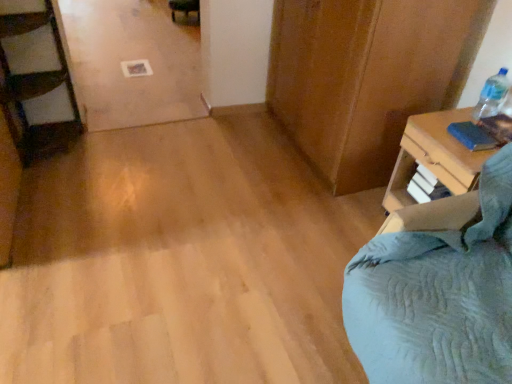
Question: From a real-world perspective, is blue fabric at right below blue matte book at upper right?

Choices:
 (A) no
 (B) yes

Answer: (B)

Question: From the image's perspective, is blue fabric at right below blue matte book at upper right?

Choices:
 (A) yes
 (B) no

Answer: (A)

Question: Is blue fabric at right surrounding blue matte book at upper right?

Choices:
 (A) yes
 (B) no

Answer: (B)

Question: Could you tell me if blue fabric at right is turned towards blue matte book at upper right?

Choices:
 (A) yes
 (B) no

Answer: (B)

Question: Does blue fabric at right have a larger size compared to blue matte book at upper right?

Choices:
 (A) no
 (B) yes

Answer: (B)

Question: Can you confirm if blue fabric at right is wider than blue matte book at upper right?

Choices:
 (A) yes
 (B) no

Answer: (A)

Question: Is blue matte book at upper right oriented towards clear plastic bottle at upper right?

Choices:
 (A) yes
 (B) no

Answer: (B)

Question: Considering the relative sizes of blue matte book at upper right and clear plastic bottle at upper right in the image provided, is blue matte book at upper right wider than clear plastic bottle at upper right?

Choices:
 (A) no
 (B) yes

Answer: (B)

Question: From the image's perspective, is blue matte book at upper right on clear plastic bottle at upper right?

Choices:
 (A) no
 (B) yes

Answer: (A)

Question: From the image's perspective, does blue matte book at upper right appear lower than clear plastic bottle at upper right?

Choices:
 (A) no
 (B) yes

Answer: (B)

Question: Does blue matte book at upper right lie behind clear plastic bottle at upper right?

Choices:
 (A) yes
 (B) no

Answer: (B)

Question: Considering the relative sizes of blue matte book at upper right and clear plastic bottle at upper right in the image provided, is blue matte book at upper right bigger than clear plastic bottle at upper right?

Choices:
 (A) no
 (B) yes

Answer: (A)

Question: Does blue fabric at right have a lesser height compared to clear plastic bottle at upper right?

Choices:
 (A) no
 (B) yes

Answer: (A)